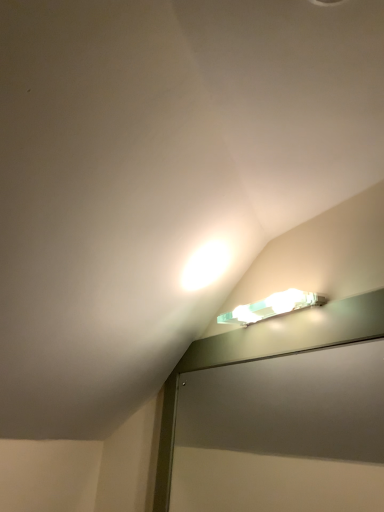
Question: In terms of width, does translucent plastic light fixture at upper right look wider or thinner when compared to clear glass screen door at upper center?

Choices:
 (A) wide
 (B) thin

Answer: (A)

Question: In the image, is translucent plastic light fixture at upper right positioned in front of or behind clear glass screen door at upper center?

Choices:
 (A) behind
 (B) front

Answer: (A)

Question: Based on their positions, is translucent plastic light fixture at upper right located to the left or right of clear glass screen door at upper center?

Choices:
 (A) right
 (B) left

Answer: (A)

Question: Does point (185, 464) appear closer or farther from the camera than point (243, 318)?

Choices:
 (A) farther
 (B) closer

Answer: (A)

Question: Would you say clear glass screen door at upper center is inside or outside translucent plastic light fixture at upper right?

Choices:
 (A) inside
 (B) outside

Answer: (B)

Question: Is clear glass screen door at upper center bigger or smaller than translucent plastic light fixture at upper right?

Choices:
 (A) big
 (B) small

Answer: (A)

Question: In terms of height, does clear glass screen door at upper center look taller or shorter compared to translucent plastic light fixture at upper right?

Choices:
 (A) short
 (B) tall

Answer: (B)